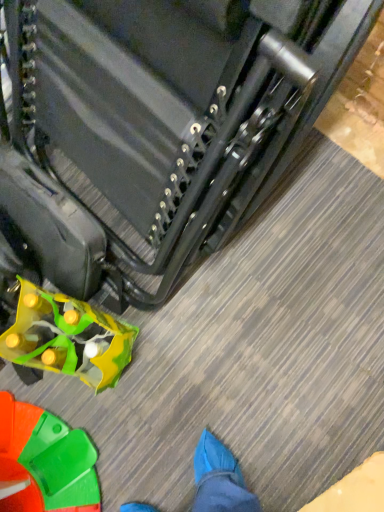
Measure the distance between translucent yellow-green bag at lower left and camera.

translucent yellow-green bag at lower left is 90.95 centimeters from camera.

Image resolution: width=384 pixels, height=512 pixels. Identify the location of translucent yellow-green bag at lower left. click(67, 337).

What do you see at coordinates (67, 337) in the screenshot?
I see `translucent yellow-green bag at lower left` at bounding box center [67, 337].

The image size is (384, 512). What are the coordinates of `translucent yellow-green bag at lower left` in the screenshot? It's located at (67, 337).